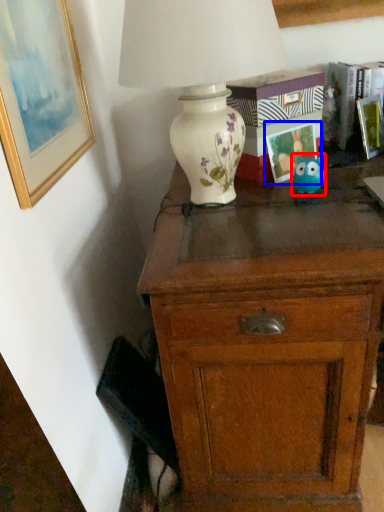
Question: Which of the following is the farthest to the observer, toy (highlighted by a red box) or picture frame (highlighted by a blue box)?

Choices:
 (A) toy
 (B) picture frame

Answer: (B)